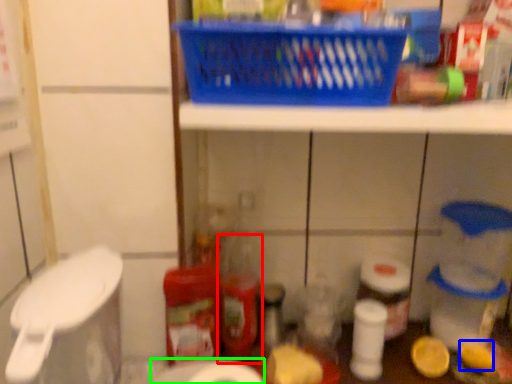
Question: Which object is positioned closest to bottle (highlighted by a red box)? Select from toilet paper (highlighted by a blue box) and toilet paper (highlighted by a green box).

Choices:
 (A) toilet paper
 (B) toilet paper

Answer: (B)